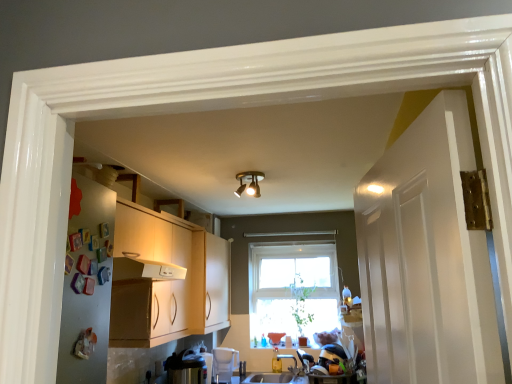
Locate an element on the screen. vacant space situated above gold metallic light fixture at center (from a real-world perspective) is located at coordinates (256, 173).